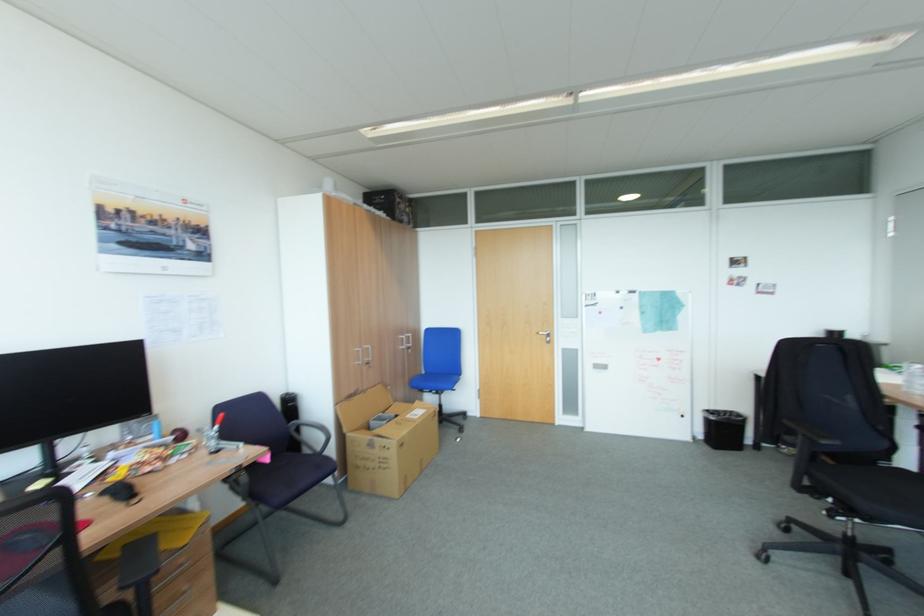
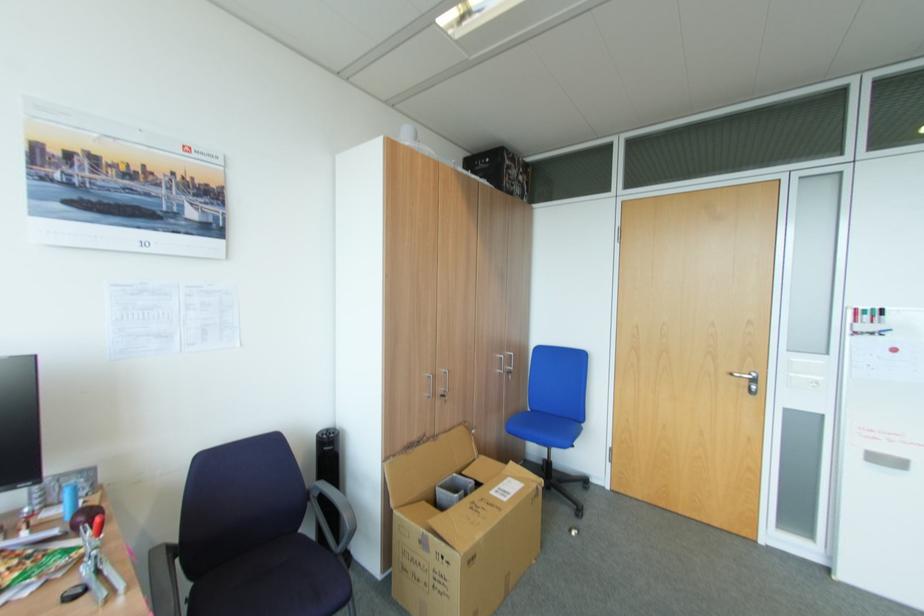
Find the pixel in the second image that matches point (219, 443) in the first image.

(91, 569)